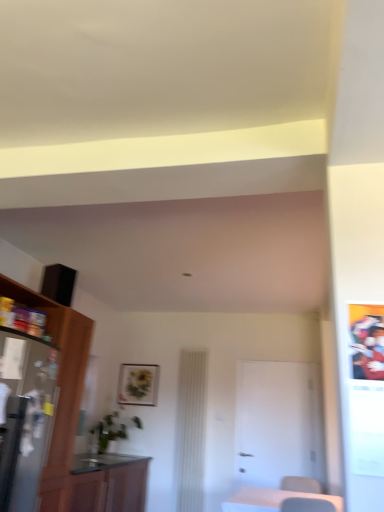
Question: Does wooden table at lower right come behind metallic silver refrigerator at left?

Choices:
 (A) yes
 (B) no

Answer: (A)

Question: From the image's perspective, is wooden table at lower right located above metallic silver refrigerator at left?

Choices:
 (A) no
 (B) yes

Answer: (A)

Question: Is wooden table at lower right taller than metallic silver refrigerator at left?

Choices:
 (A) no
 (B) yes

Answer: (A)

Question: Does wooden table at lower right have a lesser height compared to metallic silver refrigerator at left?

Choices:
 (A) no
 (B) yes

Answer: (B)

Question: From a real-world perspective, is wooden table at lower right positioned under metallic silver refrigerator at left based on gravity?

Choices:
 (A) yes
 (B) no

Answer: (A)

Question: Does point (124, 390) appear closer or farther from the camera than point (91, 458)?

Choices:
 (A) farther
 (B) closer

Answer: (A)

Question: Which is correct: matte black picture frame at center is inside wooden cabinet at lower left, which is counted as the 2th cabinetry, starting from the top, or outside of it?

Choices:
 (A) outside
 (B) inside

Answer: (A)

Question: From the image's perspective, is matte black picture frame at center located above or below wooden cabinet at lower left, which is counted as the 2th cabinetry, starting from the top?

Choices:
 (A) above
 (B) below

Answer: (A)

Question: Would you say matte black picture frame at center is to the left or to the right of wooden cabinet at lower left, positioned as the first cabinetry in bottom-to-top order, in the picture?

Choices:
 (A) left
 (B) right

Answer: (B)

Question: Based on their positions, is white matte door at center located to the left or right of matte black picture frame at center?

Choices:
 (A) left
 (B) right

Answer: (B)

Question: Does point (251, 400) appear closer or farther from the camera than point (144, 374)?

Choices:
 (A) farther
 (B) closer

Answer: (B)

Question: Looking at the image, does white matte door at center seem bigger or smaller compared to matte black picture frame at center?

Choices:
 (A) big
 (B) small

Answer: (A)

Question: Considering the positions of white matte door at center and matte black picture frame at center in the image, is white matte door at center wider or thinner than matte black picture frame at center?

Choices:
 (A) wide
 (B) thin

Answer: (A)

Question: Is wooden cabinet at lower left, which is counted as the 2th cabinetry, starting from the top, bigger or smaller than wooden cabinet at left, marked as the 1th cabinetry in a top-to-bottom arrangement?

Choices:
 (A) small
 (B) big

Answer: (A)

Question: Considering the relative positions of wooden cabinet at lower left, which is counted as the 2th cabinetry, starting from the top, and wooden cabinet at left, placed as the 2th cabinetry when sorted from bottom to top, in the image provided, is wooden cabinet at lower left, which is counted as the 2th cabinetry, starting from the top, to the left or to the right of wooden cabinet at left, placed as the 2th cabinetry when sorted from bottom to top,?

Choices:
 (A) right
 (B) left

Answer: (A)